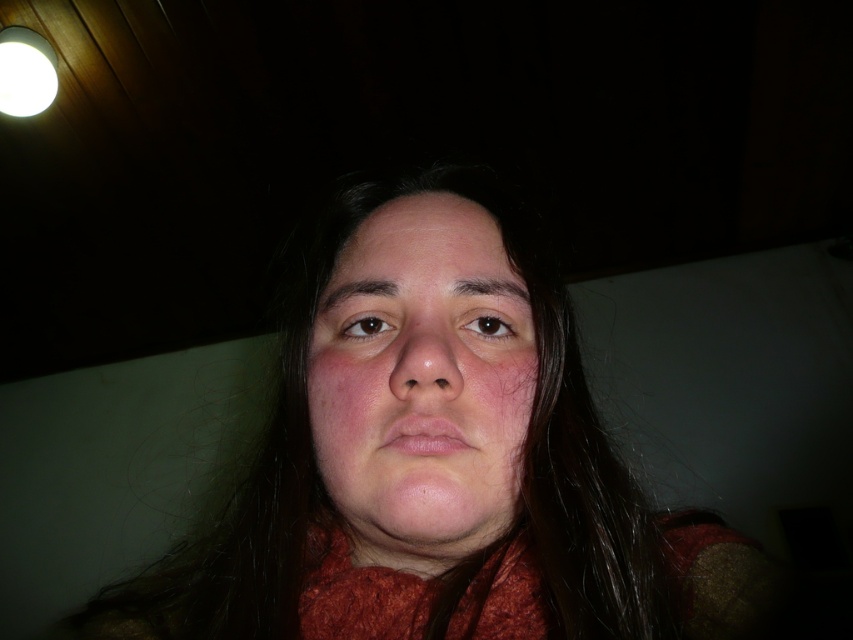
Question: Is the position of matte orange scarf at center more distant than that of smooth skin face at center?

Choices:
 (A) no
 (B) yes

Answer: (A)

Question: Considering the relative positions of matte orange scarf at center and smooth skin face at center in the image provided, where is matte orange scarf at center located with respect to smooth skin face at center?

Choices:
 (A) above
 (B) below

Answer: (B)

Question: Which of the following is the farthest from the observer?

Choices:
 (A) smooth skin face at center
 (B) matte orange scarf at center

Answer: (A)

Question: Which point appears closest to the camera in this image?

Choices:
 (A) (543, 595)
 (B) (502, 332)

Answer: (B)

Question: Is matte orange scarf at center wider than smooth skin face at center?

Choices:
 (A) no
 (B) yes

Answer: (B)

Question: Among these objects, which one is farthest from the camera?

Choices:
 (A) smooth skin face at center
 (B) matte orange scarf at center

Answer: (A)